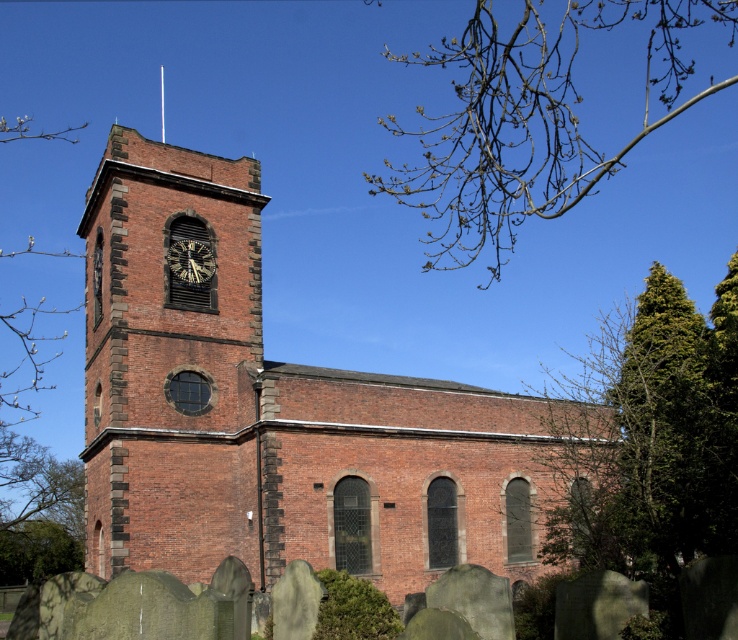
You are standing in front of the church and notice the brown brick clock tower at left and the bare branches at upper right. Which object appears taller in the image?

The brown brick clock tower at left has a lesser height compared to the bare branches at upper right, so the bare branches at upper right appear taller.

You are standing in a park and looking at the brick church at center and the bare branches at upper right. Which object is positioned more to the east if the sun is setting in the west?

The brick church at center is to the left of bare branches at upper right, so if the sun is setting in the west, the bare branches at upper right are positioned more to the east since they are on the right side of the church.